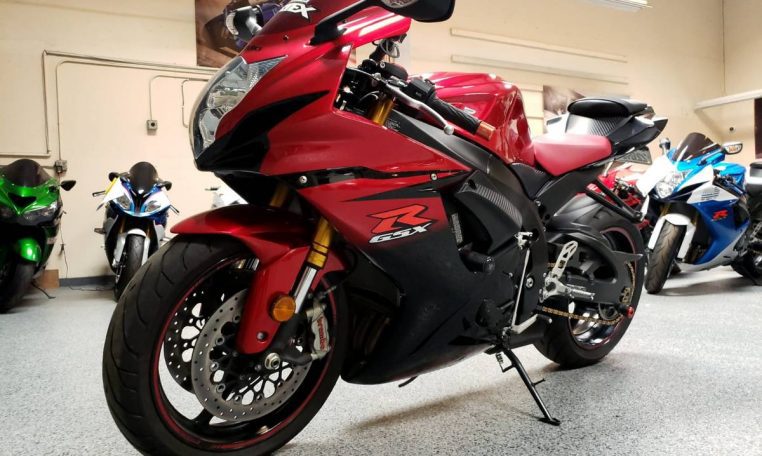
Locate an element on the screen. This screenshot has height=456, width=762. floor is located at coordinates (708, 327).